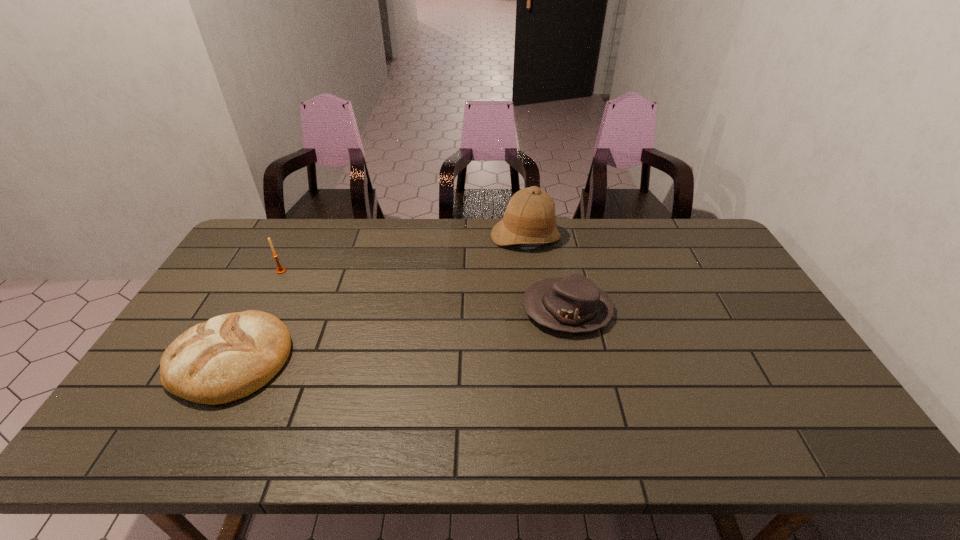
You are a GUI agent. You are given a task and a screenshot of the screen. Output one action in this format:
    pyautogui.click(x=<x>, y=<y>)
    Task: Click on the object that is the closest to the bread
    The image size is (960, 540).
    Given the screenshot: What is the action you would take?
    pyautogui.click(x=280, y=270)